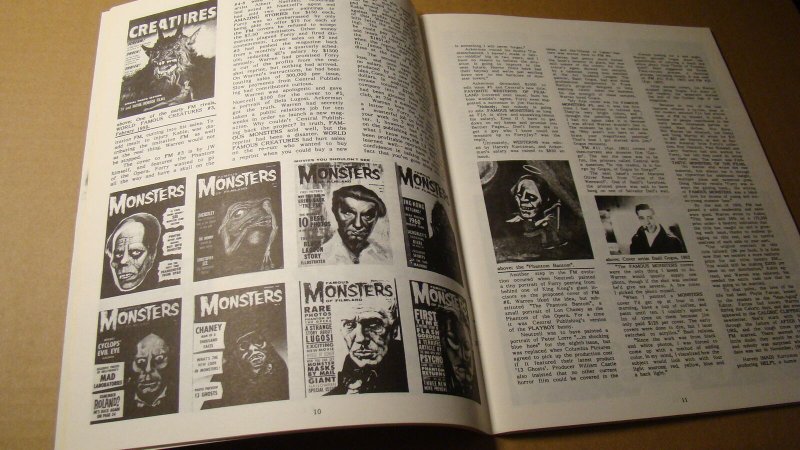
This screenshot has height=450, width=800. I want to click on magazine, so click(317, 126).